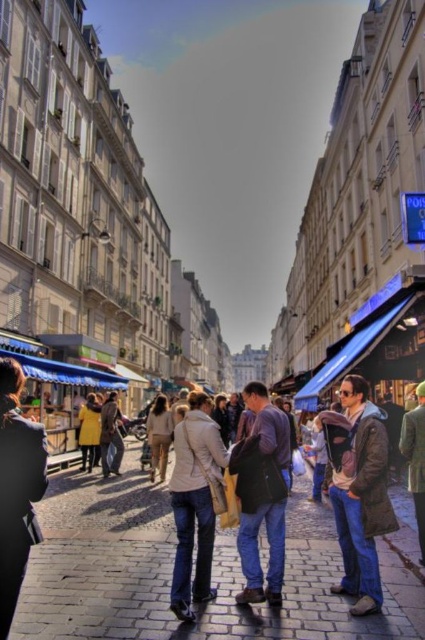
You are a street performer standing on the cobblestone street in the European city scene. You need to place your dark blue jeans at center and light beige sweater at center side by side. Which item should you place first to the left to ensure there is enough space for both?

The dark blue jeans at center should be placed first to the left since it is wider than the light beige sweater at center, allowing enough space for both items when placed side by side.